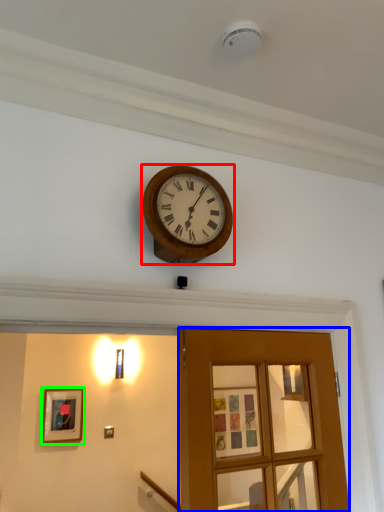
Question: Which is farther away from wall clock (highlighted by a red box)? door (highlighted by a blue box) or picture frame (highlighted by a green box)?

Choices:
 (A) door
 (B) picture frame

Answer: (B)